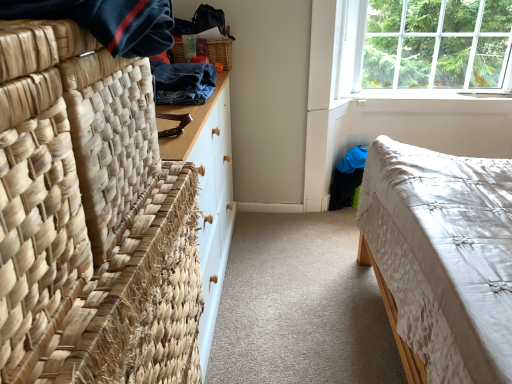
Describe the element at coordinates (77, 203) in the screenshot. I see `natural woven mat at left` at that location.

Describe the element at coordinates (444, 255) in the screenshot. I see `white quilted fabric bed at lower right` at that location.

Identify the location of denim fabric at upper left, the second clothing from the front. (182, 82).

What do you see at coordinates (424, 44) in the screenshot? Image resolution: width=512 pixels, height=384 pixels. I see `clear glass window at upper right` at bounding box center [424, 44].

Find the location of a particular element. woven wood picnic basket at upper center is located at coordinates (221, 53).

You are a GUI agent. You are given a task and a screenshot of the screen. Output one action in this format:
    pyautogui.click(x=<x>, y=<y>)
    Task: Click on the natural woven mat at left
    
    Given the screenshot: What is the action you would take?
    pyautogui.click(x=77, y=203)

Which of these two, denim fabric at upper left, acting as the first clothing starting from the back, or woven wood picnic basket at upper center, is smaller?

With smaller size is woven wood picnic basket at upper center.

Could you measure the distance between denim fabric at upper left, the second clothing from the front, and woven wood picnic basket at upper center?

A distance of 14.63 inches exists between denim fabric at upper left, the second clothing from the front, and woven wood picnic basket at upper center.

Which of these two, denim fabric at upper left, the second clothing from the front, or woven wood picnic basket at upper center, stands taller?

Standing taller between the two is woven wood picnic basket at upper center.

Is denim fabric at upper left, acting as the first clothing starting from the back, aimed at woven wood picnic basket at upper center?

No, denim fabric at upper left, acting as the first clothing starting from the back, is not facing towards woven wood picnic basket at upper center.

Who is taller, dark blue woven fabric at upper left, the second clothing viewed from the back, or denim fabric at upper left, acting as the first clothing starting from the back?

denim fabric at upper left, acting as the first clothing starting from the back.

How many degrees apart are the facing directions of dark blue woven fabric at upper left, which is the 1th clothing from front to back, and denim fabric at upper left, the second clothing from the front?

The angular difference between dark blue woven fabric at upper left, which is the 1th clothing from front to back, and denim fabric at upper left, the second clothing from the front, is 4.02 degrees.

Is dark blue woven fabric at upper left, the second clothing viewed from the back, oriented away from denim fabric at upper left, acting as the first clothing starting from the back?

No, dark blue woven fabric at upper left, the second clothing viewed from the back, is not facing the opposite direction of denim fabric at upper left, acting as the first clothing starting from the back.

Considering the sizes of objects dark blue woven fabric at upper left, the second clothing viewed from the back, and denim fabric at upper left, acting as the first clothing starting from the back, in the image provided, who is bigger, dark blue woven fabric at upper left, the second clothing viewed from the back, or denim fabric at upper left, acting as the first clothing starting from the back,?

Bigger between the two is dark blue woven fabric at upper left, the second clothing viewed from the back.

Considering the positions of point (100, 280) and point (474, 20), is point (100, 280) closer or farther from the camera than point (474, 20)?

Point (100, 280) is positioned closer to the camera compared to point (474, 20).

Is natural woven mat at left to the left of clear glass window at upper right from the viewer's perspective?

Yes, natural woven mat at left is to the left of clear glass window at upper right.

Would you consider natural woven mat at left to be distant from clear glass window at upper right?

Indeed, natural woven mat at left is not near clear glass window at upper right.

Measure the distance between natural woven mat at left and clear glass window at upper right.

A distance of 6.76 feet exists between natural woven mat at left and clear glass window at upper right.

In the image, is woven wood picnic basket at upper center positioned in front of or behind clear glass window at upper right?

woven wood picnic basket at upper center is in front of clear glass window at upper right.

Between woven wood picnic basket at upper center and clear glass window at upper right, which one has more height?

With more height is clear glass window at upper right.

How many degrees apart are the facing directions of woven wood picnic basket at upper center and clear glass window at upper right?

They differ by 1.81 degrees in their facing directions.

Are woven wood picnic basket at upper center and clear glass window at upper right beside each other?

No, woven wood picnic basket at upper center is not next to clear glass window at upper right.

From a real-world perspective, is natural woven mat at left on top of white quilted fabric bed at lower right?

Yes.

Is natural woven mat at left with white quilted fabric bed at lower right?

No, natural woven mat at left is not making contact with white quilted fabric bed at lower right.

Which object is wider, natural woven mat at left or white quilted fabric bed at lower right?

white quilted fabric bed at lower right.

Is dark blue woven fabric at upper left, the second clothing viewed from the back, with natural woven mat at left?

They are not placed beside each other.

Is natural woven mat at left completely or partially inside dark blue woven fabric at upper left, the second clothing viewed from the back?

Actually, natural woven mat at left is outside dark blue woven fabric at upper left, the second clothing viewed from the back.

Looking at this image, can you confirm if dark blue woven fabric at upper left, the second clothing viewed from the back, is shorter than natural woven mat at left?

Yes.

From a real-world perspective, is clear glass window at upper right physically located above or below dark blue woven fabric at upper left, which is the 1th clothing from front to back?

clear glass window at upper right is below dark blue woven fabric at upper left, which is the 1th clothing from front to back.

Which is more to the right, clear glass window at upper right or dark blue woven fabric at upper left, the second clothing viewed from the back?

clear glass window at upper right is more to the right.

Can you confirm if clear glass window at upper right is wider than dark blue woven fabric at upper left, which is the 1th clothing from front to back?

No.

How different are the orientations of clear glass window at upper right and dark blue woven fabric at upper left, which is the 1th clothing from front to back, in degrees?

clear glass window at upper right and dark blue woven fabric at upper left, which is the 1th clothing from front to back, are facing 90.3 degrees away from each other.

Identify the location of picnic basket to the right of denim fabric at upper left, the second clothing from the front. The height and width of the screenshot is (384, 512). (221, 53).

Locate an element on the screen. This screenshot has height=384, width=512. clothing above the denim fabric at upper left, acting as the first clothing starting from the back (from a real-world perspective) is located at coordinates (106, 21).

Based on their spatial positions, is natural woven mat at left or woven wood picnic basket at upper center closer to dark blue woven fabric at upper left, the second clothing viewed from the back?

natural woven mat at left is positioned closer to the anchor dark blue woven fabric at upper left, the second clothing viewed from the back.

Estimate the real-world distances between objects in this image. Which object is further from clear glass window at upper right, denim fabric at upper left, acting as the first clothing starting from the back, or woven wood picnic basket at upper center?

denim fabric at upper left, acting as the first clothing starting from the back, lies further to clear glass window at upper right than the other object.

Which object lies further to the anchor point natural woven mat at left, dark blue woven fabric at upper left, the second clothing viewed from the back, or denim fabric at upper left, acting as the first clothing starting from the back?

denim fabric at upper left, acting as the first clothing starting from the back, is further to natural woven mat at left.

When comparing their distances from natural woven mat at left, does dark blue woven fabric at upper left, the second clothing viewed from the back, or white quilted fabric bed at lower right seem further?

white quilted fabric bed at lower right.

Estimate the real-world distances between objects in this image. Which object is further from dark blue woven fabric at upper left, the second clothing viewed from the back, denim fabric at upper left, acting as the first clothing starting from the back, or natural woven mat at left?

denim fabric at upper left, acting as the first clothing starting from the back, is further to dark blue woven fabric at upper left, the second clothing viewed from the back.

Estimate the real-world distances between objects in this image. Which object is further from dark blue woven fabric at upper left, which is the 1th clothing from front to back, natural woven mat at left or white quilted fabric bed at lower right?

white quilted fabric bed at lower right is positioned further to the anchor dark blue woven fabric at upper left, which is the 1th clothing from front to back.

From the image, which object appears to be farther from clear glass window at upper right, natural woven mat at left or white quilted fabric bed at lower right?

natural woven mat at left.

Which object lies nearer to the anchor point woven wood picnic basket at upper center, clear glass window at upper right or natural woven mat at left?

clear glass window at upper right is closer to woven wood picnic basket at upper center.

Locate an element on the screen. furniture between dark blue woven fabric at upper left, which is the 1th clothing from front to back, and woven wood picnic basket at upper center in the front-back direction is located at coordinates (77, 203).

At what (x,y) coordinates should I click in order to perform the action: click on clothing between natural woven mat at left and woven wood picnic basket at upper center in the front-back direction. Please return your answer as a coordinate pair (x, y). This screenshot has width=512, height=384. Looking at the image, I should click on [x=182, y=82].

Find the location of a particular element. picnic basket positioned between dark blue woven fabric at upper left, the second clothing viewed from the back, and clear glass window at upper right from near to far is located at coordinates (221, 53).

Where is `picnic basket between denim fabric at upper left, the second clothing from the front, and clear glass window at upper right, in the horizontal direction`? picnic basket between denim fabric at upper left, the second clothing from the front, and clear glass window at upper right, in the horizontal direction is located at coordinates (221, 53).